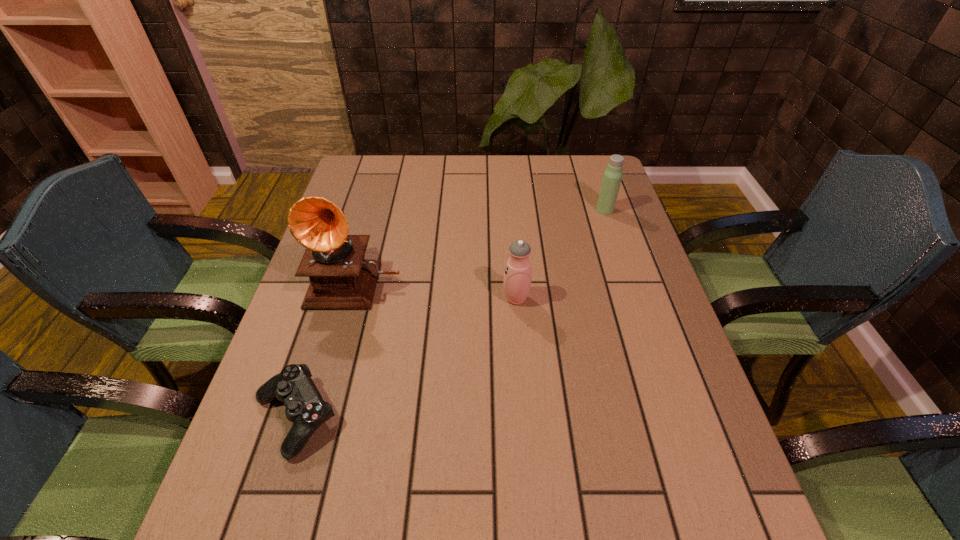
Find the location of a particular element. This screenshot has height=540, width=960. phonograph record is located at coordinates pos(340,278).

You are a GUI agent. You are given a task and a screenshot of the screen. Output one action in this format:
    pyautogui.click(x=<x>, y=<y>)
    Task: Click on the nearer thermos bottle
    Image resolution: width=960 pixels, height=540 pixels.
    Given the screenshot: What is the action you would take?
    pyautogui.click(x=517, y=277)

The width and height of the screenshot is (960, 540). Find the location of `the left thermos bottle`. the left thermos bottle is located at coordinates (517, 277).

Where is `the right thermos bottle`? the right thermos bottle is located at coordinates (612, 177).

The height and width of the screenshot is (540, 960). What are the coordinates of `the rightmost object` in the screenshot? It's located at (612, 177).

The height and width of the screenshot is (540, 960). In order to click on the shortest object in this screenshot , I will do tap(305, 408).

This screenshot has height=540, width=960. Identify the location of control. (305, 408).

The image size is (960, 540). Identify the location of free location located on the horn of the phonograph record. (346, 326).

Where is `vacant space situated 0.050m on the left of the left thermos bottle`? The height and width of the screenshot is (540, 960). vacant space situated 0.050m on the left of the left thermos bottle is located at coordinates (483, 299).

Where is `vacant area situated on the front of the right thermos bottle`? This screenshot has height=540, width=960. vacant area situated on the front of the right thermos bottle is located at coordinates (633, 294).